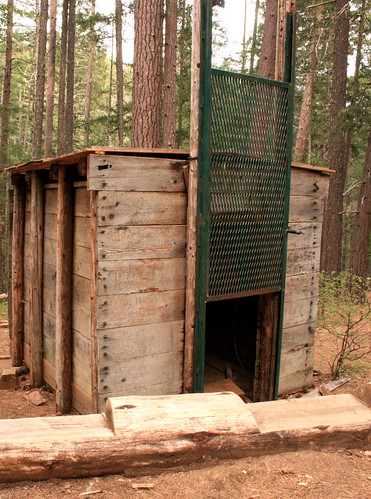
You are a GUI agent. You are given a task and a screenshot of the screen. Output one action in this format:
    pyautogui.click(x=<x>, y=<y>)
    Task: Click on the metal sliding door
    
    Given the screenshot: What is the action you would take?
    pyautogui.click(x=241, y=223)